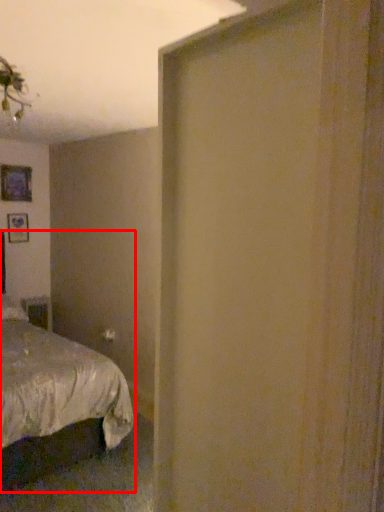
Question: Observing the image, what is the correct spatial positioning of bed (annotated by the red box) in reference to picture frame?

Choices:
 (A) left
 (B) right

Answer: (B)